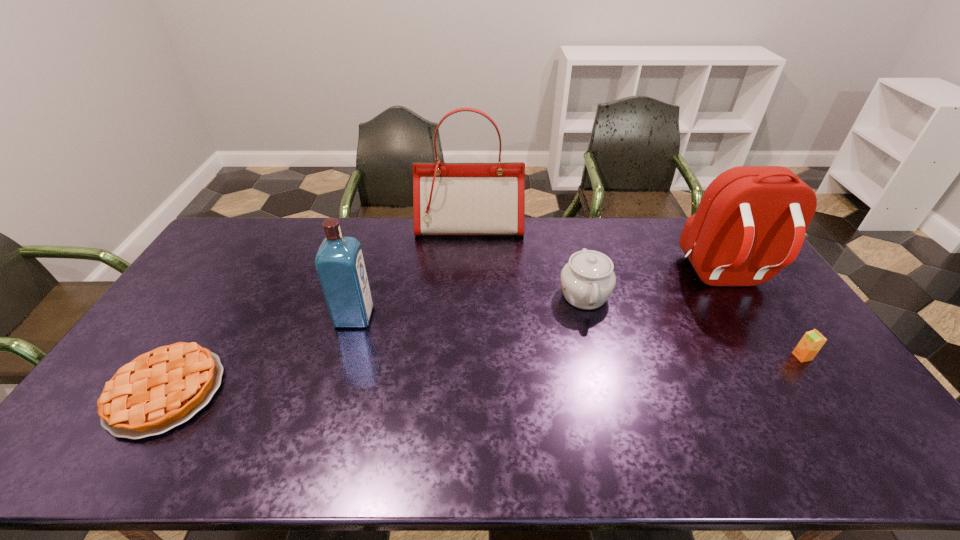
Locate an element on the screen. This screenshot has width=960, height=540. the third object from left to right is located at coordinates (448, 198).

Where is `the farthest object`? Image resolution: width=960 pixels, height=540 pixels. the farthest object is located at coordinates (448, 198).

Locate an element on the screen. The image size is (960, 540). backpack is located at coordinates (750, 223).

Find the location of `liquor`. liquor is located at coordinates (340, 264).

You are a GUI agent. You are given a task and a screenshot of the screen. Output one action in this format:
    pyautogui.click(x=<x>, y=<y>)
    Task: Click on the second object from left to right
    The image size is (960, 540).
    Given the screenshot: What is the action you would take?
    pyautogui.click(x=340, y=264)

The width and height of the screenshot is (960, 540). In order to click on chinaware in this screenshot , I will do `click(587, 280)`.

Where is `the third shortest object`? the third shortest object is located at coordinates (587, 280).

Image resolution: width=960 pixels, height=540 pixels. Find the location of `the fifth tallest object`. the fifth tallest object is located at coordinates [x=810, y=344].

The width and height of the screenshot is (960, 540). What are the coordinates of `the shortest object` in the screenshot? It's located at (161, 389).

Find the location of `the leftmost object`. the leftmost object is located at coordinates (161, 389).